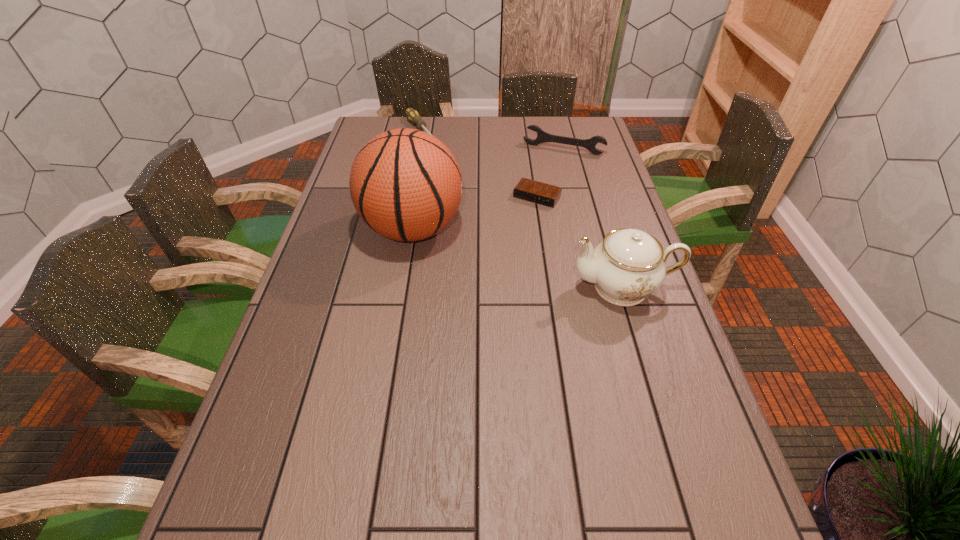
Select which object appears as the third closest to the wrench. Please provide its 2D coordinates. Your answer should be formatted as a tuple, i.e. [(x, y)], where the tuple contains the x and y coordinates of a point satisfying the conditions above.

[(405, 184)]

Identify the location of blank space that satisfies the following two spatial constraints: 1. on the front side of the fourth tallest object; 2. on the side where the inflation valve is located. This screenshot has height=540, width=960. (402, 229).

I want to click on vacant region that satisfies the following two spatial constraints: 1. on the front side of the alarm clock; 2. at the spout of the chinaware, so click(550, 287).

Locate an element on the screen. vacant space that satisfies the following two spatial constraints: 1. on the front side of the wrench; 2. at the spout of the chinaware is located at coordinates (x=598, y=287).

Where is `free space that satisfies the following two spatial constraints: 1. on the front side of the chinaware; 2. at the spout of the screwdriver`? The width and height of the screenshot is (960, 540). free space that satisfies the following two spatial constraints: 1. on the front side of the chinaware; 2. at the spout of the screwdriver is located at coordinates (392, 287).